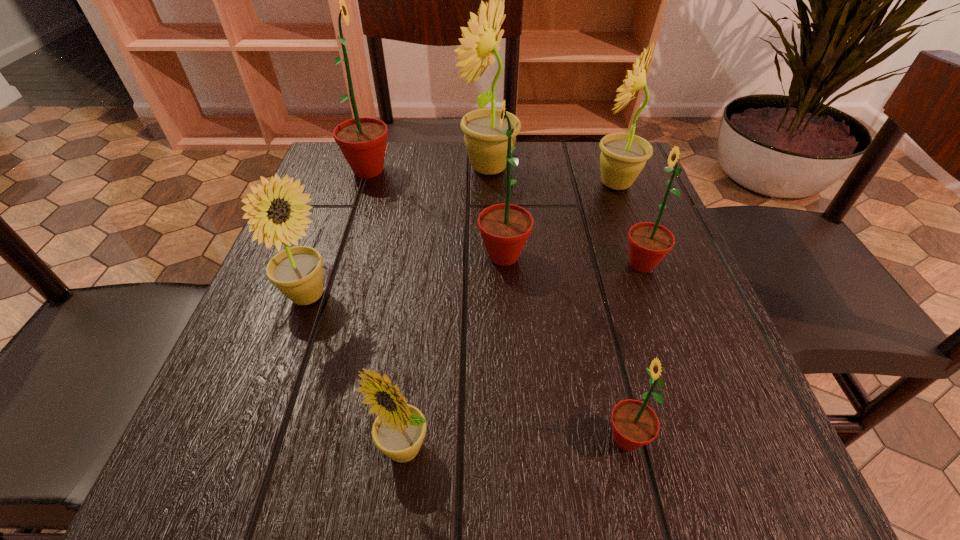
Locate an element on the screen. The width and height of the screenshot is (960, 540). free space between the rightmost yellow sunflower and the third smallest green sunflower is located at coordinates (560, 219).

Identify the location of vacant point located between the biggest green sunflower and the third farthest yellow sunflower. click(338, 233).

The height and width of the screenshot is (540, 960). I want to click on free space between the biggest green sunflower and the nearest yellow sunflower, so click(x=386, y=309).

Image resolution: width=960 pixels, height=540 pixels. I want to click on free point between the third biggest yellow sunflower and the leftmost green sunflower, so click(338, 233).

Where is `blank region between the second biggest yellow sunflower and the leftmost yellow sunflower`? This screenshot has height=540, width=960. blank region between the second biggest yellow sunflower and the leftmost yellow sunflower is located at coordinates (462, 240).

Find the location of a particular element. The width and height of the screenshot is (960, 540). vacant space in between the third object from left to right and the third green sunflower from left to right is located at coordinates (515, 444).

In order to click on free space between the third smallest yellow sunflower and the leftmost yellow sunflower in this screenshot , I will do `click(462, 240)`.

You are a GUI agent. You are given a task and a screenshot of the screen. Output one action in this format:
    pyautogui.click(x=<x>, y=<y>)
    Task: Click on the vacant area between the farthest green sunflower and the second biggest green sunflower
    The height and width of the screenshot is (540, 960).
    Given the screenshot: What is the action you would take?
    pyautogui.click(x=436, y=213)

Where is `free point between the second green sunflower from left to right and the rightmost yellow sunflower`? free point between the second green sunflower from left to right and the rightmost yellow sunflower is located at coordinates (560, 219).

Find the location of a particular element. free space that is in between the third object from right to left and the third smallest yellow sunflower is located at coordinates (621, 311).